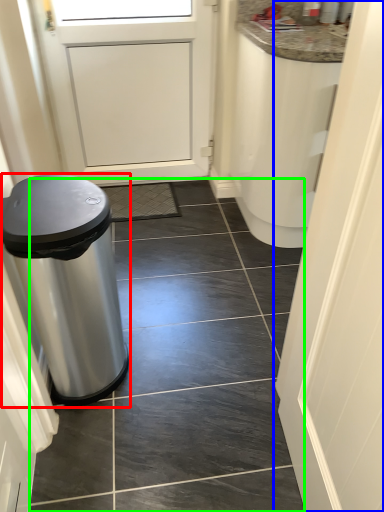
Question: Estimate the real-world distances between objects in this image. Which object is farther from waste container (highlighted by a red box), door (highlighted by a blue box) or tile (highlighted by a green box)?

Choices:
 (A) door
 (B) tile

Answer: (A)